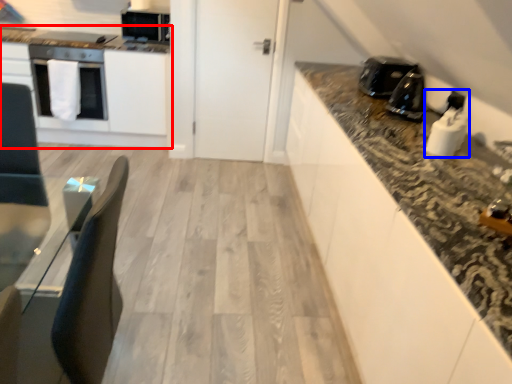
Question: Which object appears closest to the camera in this image, cabinetry (highlighted by a red box) or appliance (highlighted by a blue box)?

Choices:
 (A) cabinetry
 (B) appliance

Answer: (B)